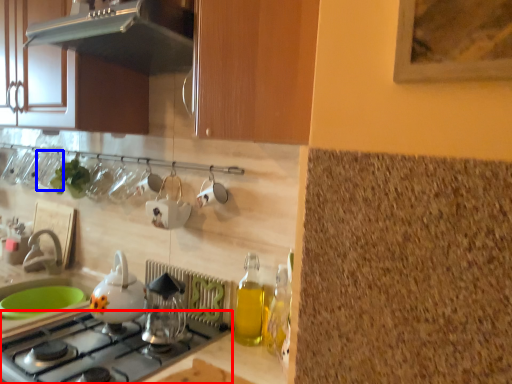
Question: Which object is further to the camera taking this photo, gas stove (highlighted by a red box) or tableware (highlighted by a blue box)?

Choices:
 (A) gas stove
 (B) tableware

Answer: (B)